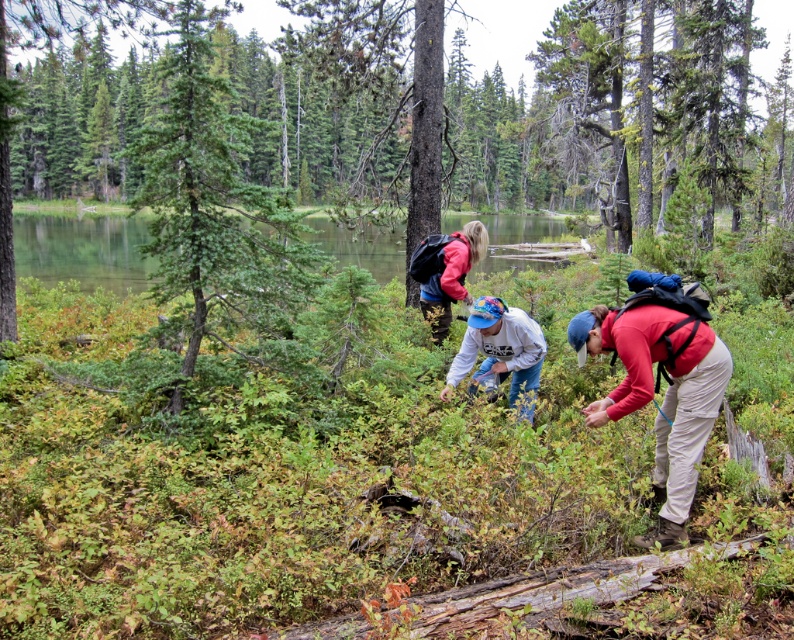
Who is higher up, red matte jacket at lower right or green leafy water at center?

green leafy water at center is above.

Identify the location of red matte jacket at lower right. This screenshot has width=794, height=640. [663, 397].

Who is taller, white cotton shirt at center or matte pink jacket at center?

Standing taller between the two is matte pink jacket at center.

Which of these two, white cotton shirt at center or matte pink jacket at center, stands shorter?

Standing shorter between the two is white cotton shirt at center.

Is point (480, 310) positioned behind point (446, 262)?

No, (480, 310) is in front of (446, 262).

The image size is (794, 640). What are the coordinates of `white cotton shirt at center` in the screenshot? It's located at 500,349.

Looking at this image, does green leafy water at center appear over matte pink jacket at center?

Correct, green leafy water at center is located above matte pink jacket at center.

Does point (388, 253) come farther from viewer compared to point (459, 285)?

Yes, point (388, 253) is farther from viewer.

The width and height of the screenshot is (794, 640). Identify the location of green leafy water at center. (83, 250).